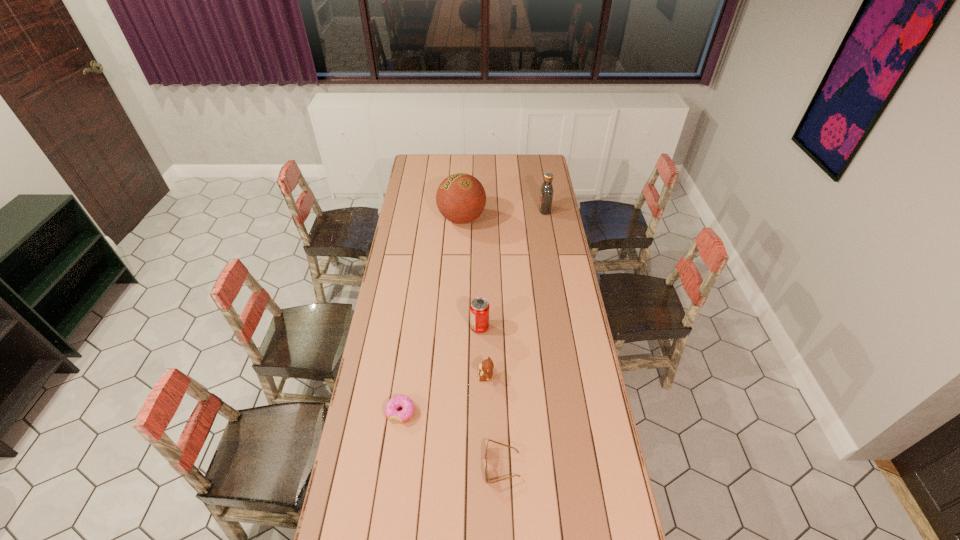
The height and width of the screenshot is (540, 960). I want to click on vacant area that lies between the fourth farthest object and the basketball, so click(474, 298).

The height and width of the screenshot is (540, 960). In order to click on free space that is in between the basketball and the teddy bear in this screenshot , I will do `click(474, 298)`.

Identify the location of free spot between the fourth farthest object and the nearest object. (494, 421).

The image size is (960, 540). I want to click on free space between the nearest object and the leftmost object, so click(x=451, y=439).

The image size is (960, 540). What are the coordinates of `free space between the third shortest object and the nearest object` in the screenshot? It's located at (494, 421).

Locate an element on the screen. The height and width of the screenshot is (540, 960). unoccupied area between the nearest object and the rightmost object is located at coordinates (523, 338).

At what (x,y) coordinates should I click in order to perform the action: click on free point between the fourth nearest object and the second tallest object. Please return your answer as a coordinate pair (x, y). Looking at the image, I should click on (513, 269).

You are a GUI agent. You are given a task and a screenshot of the screen. Output one action in this format:
    pyautogui.click(x=<x>, y=<y>)
    Task: Click on the blank region between the teddy bear and the soda can
    This screenshot has height=540, width=960.
    Given the screenshot: What is the action you would take?
    pyautogui.click(x=483, y=352)

Where is `the fifth closest object relative to the fourth shortest object`? This screenshot has width=960, height=540. the fifth closest object relative to the fourth shortest object is located at coordinates (546, 193).

Locate which object is the fifth closest to the sunglasses. Please provide its 2D coordinates. Your answer should be formatted as a tuple, i.e. [(x, y)], where the tuple contains the x and y coordinates of a point satisfying the conditions above.

[(546, 193)]